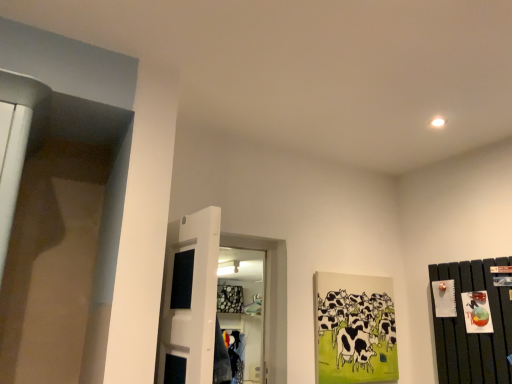
Question: From a real-world perspective, is black and white painted cows at center right physically located above or below white glossy door at center?

Choices:
 (A) below
 (B) above

Answer: (A)

Question: Is black and white painted cows at center right wider or thinner than white glossy door at center?

Choices:
 (A) wide
 (B) thin

Answer: (B)

Question: Estimate the real-world distances between objects in this image. Which object is farther from the white glossy door at center?

Choices:
 (A) dark wood dresser at right
 (B) black and white painted cows at center right

Answer: (A)

Question: Which object is positioned farthest from the dark wood dresser at right?

Choices:
 (A) black and white painted cows at center right
 (B) white glossy door at center

Answer: (B)